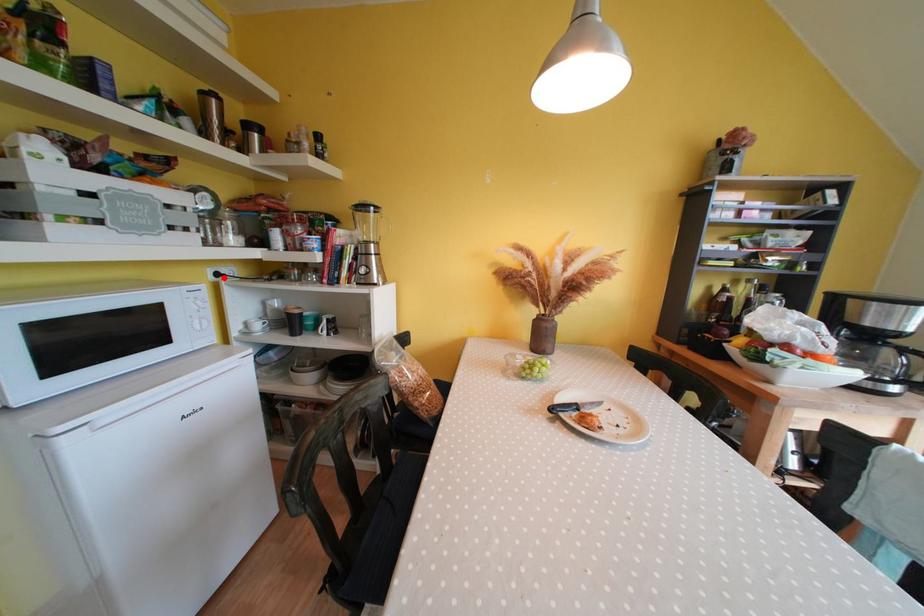
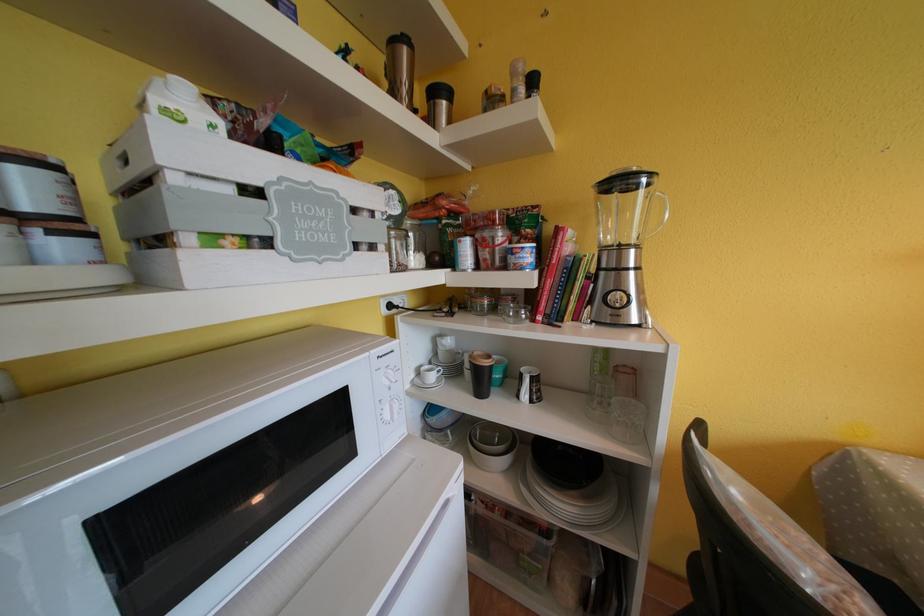
Question: I am providing you with two images of the same scene from different viewpoints. A red point is marked on the first image. At the location where the point appears in image 1, is it still visible in image 2?

Choices:
 (A) Yes
 (B) No

Answer: (A)